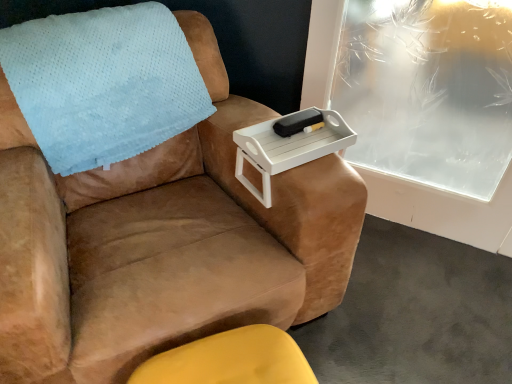
Question: Could suede brown armchair at upper right be considered to be inside light blue fleece blanket at upper left?

Choices:
 (A) no
 (B) yes

Answer: (A)

Question: Does light blue fleece blanket at upper left have a larger size compared to suede brown armchair at upper right?

Choices:
 (A) no
 (B) yes

Answer: (A)

Question: Does light blue fleece blanket at upper left have a smaller size compared to suede brown armchair at upper right?

Choices:
 (A) yes
 (B) no

Answer: (A)

Question: Is light blue fleece blanket at upper left oriented towards suede brown armchair at upper right?

Choices:
 (A) no
 (B) yes

Answer: (B)

Question: Is light blue fleece blanket at upper left behind suede brown armchair at upper right?

Choices:
 (A) no
 (B) yes

Answer: (B)

Question: Is light blue fleece blanket at upper left positioned with its back to suede brown armchair at upper right?

Choices:
 (A) no
 (B) yes

Answer: (B)

Question: From the image's perspective, would you say white plastic tray at upper right is positioned over black matte tray at upper center?

Choices:
 (A) no
 (B) yes

Answer: (A)

Question: Can you confirm if white plastic tray at upper right is shorter than black matte tray at upper center?

Choices:
 (A) no
 (B) yes

Answer: (A)

Question: Can we say white plastic tray at upper right lies outside black matte tray at upper center?

Choices:
 (A) no
 (B) yes

Answer: (B)

Question: Is white plastic tray at upper right not near black matte tray at upper center?

Choices:
 (A) yes
 (B) no

Answer: (B)

Question: Is the surface of white plastic tray at upper right in direct contact with black matte tray at upper center?

Choices:
 (A) no
 (B) yes

Answer: (B)

Question: Would you say white plastic tray at upper right contains black matte tray at upper center?

Choices:
 (A) yes
 (B) no

Answer: (A)

Question: Can you confirm if light blue fleece blanket at upper left is positioned to the left of black matte tray at upper center?

Choices:
 (A) no
 (B) yes

Answer: (B)